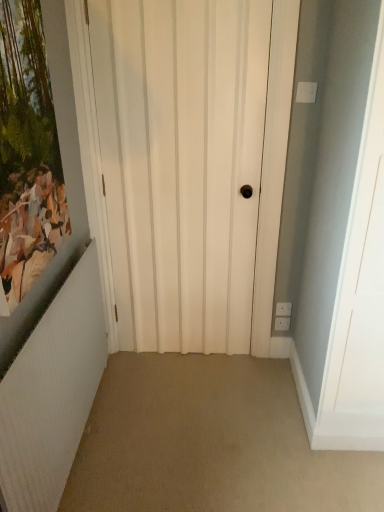
The width and height of the screenshot is (384, 512). What do you see at coordinates (181, 165) in the screenshot?
I see `white matte door at center` at bounding box center [181, 165].

Locate an element on the screen. white matte door at center is located at coordinates (181, 165).

What do you see at coordinates (27, 156) in the screenshot? I see `matte wooden picture frame at left` at bounding box center [27, 156].

The image size is (384, 512). Describe the element at coordinates (52, 393) in the screenshot. I see `white textured radiator at left` at that location.

Locate an element on the screen. The image size is (384, 512). white textured radiator at left is located at coordinates (52, 393).

Find the location of a particular element. This screenshot has height=512, width=384. white matte door at center is located at coordinates [181, 165].

From the image's perspective, which is above, matte wooden picture frame at left or white textured radiator at left?

matte wooden picture frame at left appears higher in the image.

Which object is positioned more to the left, matte wooden picture frame at left or white textured radiator at left?

matte wooden picture frame at left is more to the left.

Is matte wooden picture frame at left further to the viewer compared to white textured radiator at left?

No.

Is matte wooden picture frame at left next to white textured radiator at left?

matte wooden picture frame at left and white textured radiator at left are clearly separated.

Between white textured radiator at left and matte wooden picture frame at left, which one has smaller size?

matte wooden picture frame at left.

Looking at their sizes, would you say white textured radiator at left is wider or thinner than matte wooden picture frame at left?

Clearly, white textured radiator at left has more width compared to matte wooden picture frame at left.

Looking at this image, which is behind, white textured radiator at left or matte wooden picture frame at left?

white textured radiator at left is further from the camera.

What's the angular difference between white textured radiator at left and matte wooden picture frame at left's facing directions?

The angle between the facing direction of white textured radiator at left and the facing direction of matte wooden picture frame at left is 0.00472 degrees.

Which of these two, white textured radiator at left or white matte door at center, stands shorter?

With less height is white textured radiator at left.

Considering the relative sizes of white textured radiator at left and white matte door at center in the image provided, is white textured radiator at left bigger than white matte door at center?

Correct, white textured radiator at left is larger in size than white matte door at center.

Is white textured radiator at left in front of white matte door at center?

Yes, white textured radiator at left is in front of white matte door at center.

From a real-world perspective, which object stands above the other?

In real-world perspective, white matte door at center is above.

Is white matte door at center in front of or behind matte wooden picture frame at left in the image?

In the image, white matte door at center appears behind matte wooden picture frame at left.

Considering the relative sizes of white matte door at center and matte wooden picture frame at left in the image provided, is white matte door at center shorter than matte wooden picture frame at left?

Incorrect, the height of white matte door at center does not fall short of that of matte wooden picture frame at left.

From the image's perspective, which object appears higher, white matte door at center or matte wooden picture frame at left?

matte wooden picture frame at left appears higher in the image.

Which of these two, white matte door at center or matte wooden picture frame at left, is bigger?

white matte door at center.

Is matte wooden picture frame at left thinner than white matte door at center?

No.

Is matte wooden picture frame at left spatially inside white matte door at center, or outside of it?

matte wooden picture frame at left exists outside the volume of white matte door at center.

Identify the location of picture frame on the left of white matte door at center. (27, 156).

Based on their sizes in the image, would you say matte wooden picture frame at left is bigger or smaller than white matte door at center?

Considering their sizes, matte wooden picture frame at left takes up less space than white matte door at center.

Does white matte door at center turn towards white textured radiator at left?

Yes, white matte door at center faces towards white textured radiator at left.

Looking at this image, who is smaller, white matte door at center or white textured radiator at left?

white matte door at center.

Are white matte door at center and white textured radiator at left located far from each other?

No, white matte door at center is not far from white textured radiator at left.

From the picture: Who is shorter, white matte door at center or white textured radiator at left?

With less height is white textured radiator at left.

The image size is (384, 512). Identify the location of radiator directly beneath the matte wooden picture frame at left (from a real-world perspective). (52, 393).

Identify the location of picture frame lying above the white textured radiator at left (from the image's perspective). The height and width of the screenshot is (512, 384). (27, 156).

Which object lies nearer to the anchor point white matte door at center, white textured radiator at left or matte wooden picture frame at left?

The object closer to white matte door at center is matte wooden picture frame at left.

Considering their positions, is white textured radiator at left positioned further to matte wooden picture frame at left than white matte door at center?

Among the two, white matte door at center is located further to matte wooden picture frame at left.

From the image, which object appears to be nearer to white textured radiator at left, white matte door at center or matte wooden picture frame at left?

matte wooden picture frame at left.

Based on their spatial positions, is white matte door at center or white textured radiator at left further from matte wooden picture frame at left?

The object further to matte wooden picture frame at left is white matte door at center.

Which object lies further to the anchor point white matte door at center, matte wooden picture frame at left or white textured radiator at left?

Based on the image, white textured radiator at left appears to be further to white matte door at center.

Considering their positions, is matte wooden picture frame at left positioned further to white textured radiator at left than white matte door at center?

Among the two, white matte door at center is located further to white textured radiator at left.

In order to click on radiator between matte wooden picture frame at left and white matte door at center in the front-back direction in this screenshot , I will do `click(52, 393)`.